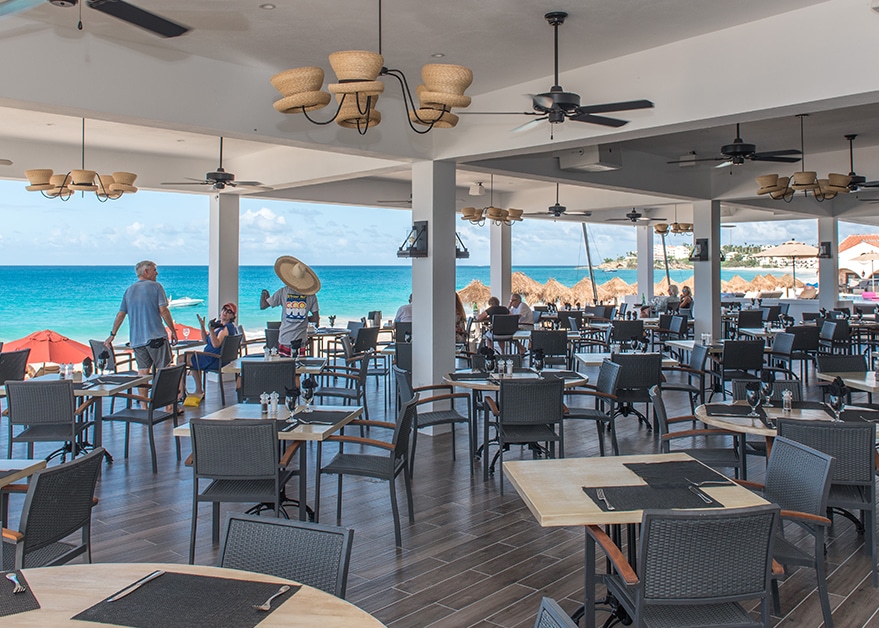
Locate an element on the screen. This screenshot has height=628, width=879. chair is located at coordinates (310, 541).